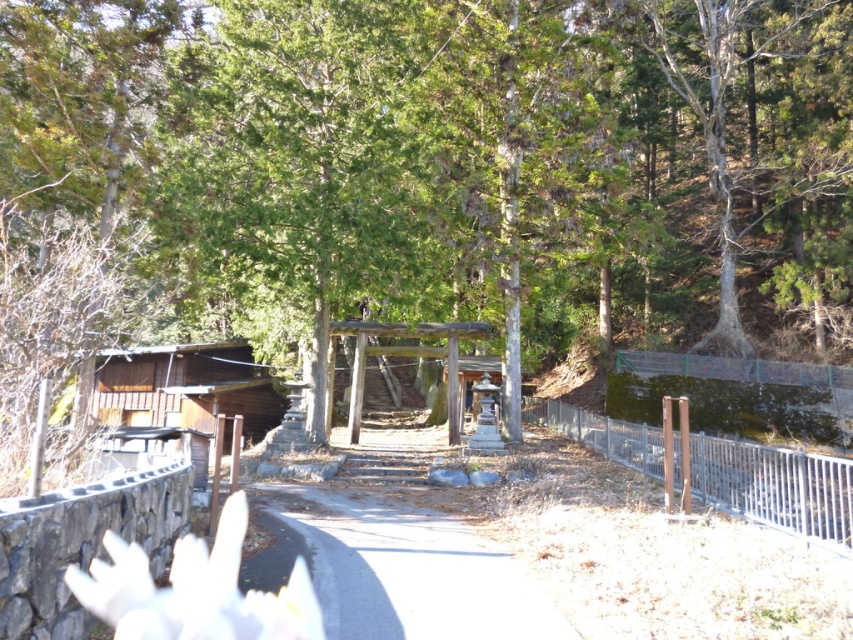
Question: Does gray concrete path at center have a lesser width compared to metallic silver fence at right?

Choices:
 (A) yes
 (B) no

Answer: (B)

Question: Estimate the real-world distances between objects in this image. Which object is closer to the green leafy tree at center?

Choices:
 (A) gray concrete path at center
 (B) metallic silver fence at right
 (C) brown wooden cabin at left

Answer: (C)

Question: Is green leafy tree at center above brown wooden cabin at left?

Choices:
 (A) no
 (B) yes

Answer: (B)

Question: Which object appears closest to the camera in this image?

Choices:
 (A) green leafy tree at center
 (B) metallic silver fence at right

Answer: (A)

Question: In this image, where is gray concrete path at center located relative to metallic silver fence at right?

Choices:
 (A) right
 (B) left

Answer: (B)

Question: Among these points, which one is nearest to the camera?

Choices:
 (A) (451, 570)
 (B) (264, 401)

Answer: (A)